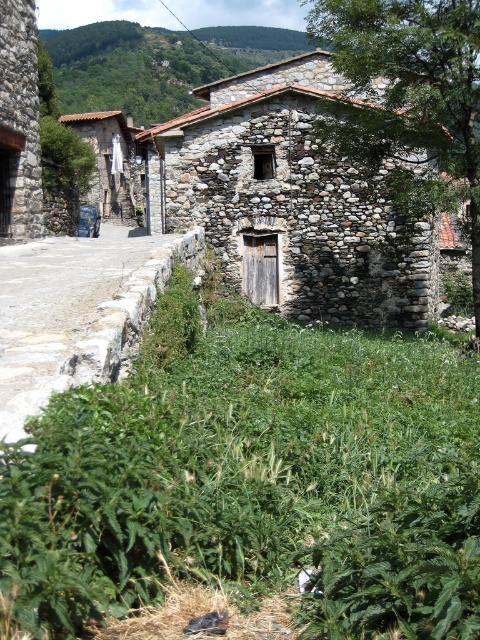
You are standing in front of the rustic stone building and want to plant a new flowerbed between the green leafy grass at center and the green leafy tree at center. Which object should you place the flowerbed closer to to ensure it doesn

The green leafy grass at center is smaller than the green leafy tree at center. Therefore, to ensure the flowerbed is appropriately sized, it should be placed closer to the green leafy grass at center since it requires less space compared to the larger tree.

You are a gardener who wants to plant a new flower bed between the green leafy grass at center and the green leafy tree at center. Which area would be better for planting, considering the thickness of the existing vegetation?

The green leafy grass at center is thinner than the green leafy tree at center, so planting between them would be better near the green leafy grass at center as it has less dense vegetation.